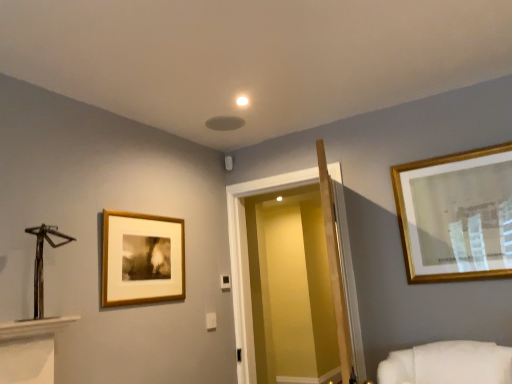
Question: From a real-world perspective, does wooden framed print at left sit lower than transparent glass door at center?

Choices:
 (A) yes
 (B) no

Answer: (B)

Question: Can you see wooden framed print at left touching transparent glass door at center?

Choices:
 (A) no
 (B) yes

Answer: (A)

Question: Does wooden framed print at left appear on the left side of transparent glass door at center?

Choices:
 (A) yes
 (B) no

Answer: (A)

Question: Is wooden framed print at left further to the viewer compared to transparent glass door at center?

Choices:
 (A) yes
 (B) no

Answer: (B)

Question: From the image's perspective, is wooden framed print at left located above transparent glass door at center?

Choices:
 (A) yes
 (B) no

Answer: (A)

Question: Is wooden framed print at left not inside transparent glass door at center?

Choices:
 (A) no
 (B) yes

Answer: (B)

Question: Considering the relative sizes of transparent glass door at center and wooden framed print at left in the image provided, is transparent glass door at center taller than wooden framed print at left?

Choices:
 (A) no
 (B) yes

Answer: (B)

Question: Is transparent glass door at center thinner than wooden framed print at left?

Choices:
 (A) yes
 (B) no

Answer: (B)

Question: Does transparent glass door at center lie in front of wooden framed print at left?

Choices:
 (A) no
 (B) yes

Answer: (A)

Question: Is transparent glass door at center behind wooden framed print at left?

Choices:
 (A) no
 (B) yes

Answer: (B)

Question: Is transparent glass door at center at the right side of wooden framed print at left?

Choices:
 (A) no
 (B) yes

Answer: (B)

Question: From a real-world perspective, is transparent glass door at center beneath wooden framed print at left?

Choices:
 (A) no
 (B) yes

Answer: (B)

Question: Is wooden framed print at left taller or shorter than transparent glass door at center?

Choices:
 (A) short
 (B) tall

Answer: (A)